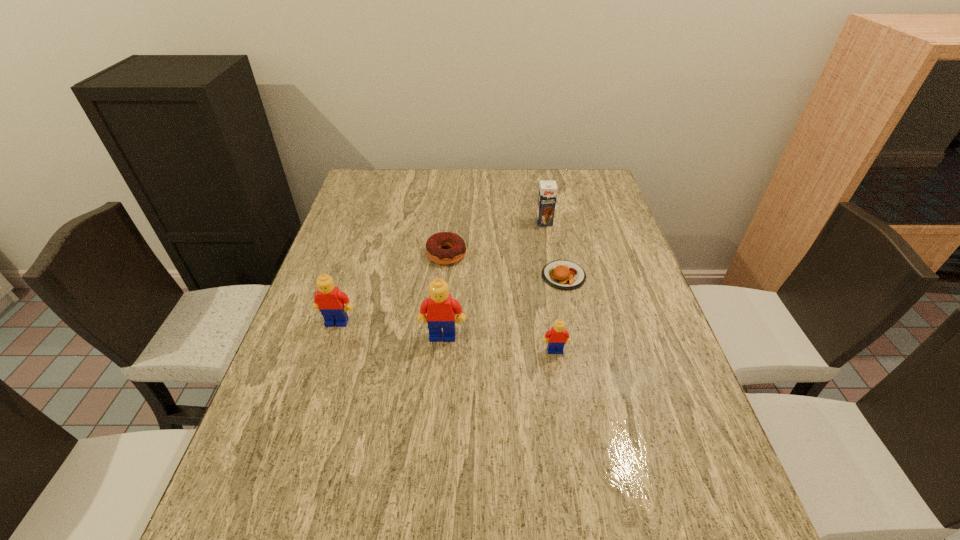
I want to click on the leftmost Lego, so click(329, 300).

The image size is (960, 540). Identify the location of the second shortest Lego. (329, 300).

Where is `the second nearest Lego`? Image resolution: width=960 pixels, height=540 pixels. the second nearest Lego is located at coordinates (440, 308).

Where is `the second Lego from right to left`? The height and width of the screenshot is (540, 960). the second Lego from right to left is located at coordinates (440, 308).

The width and height of the screenshot is (960, 540). Find the location of `the nearest Lego`. the nearest Lego is located at coordinates (558, 336).

This screenshot has width=960, height=540. Identify the location of the rightmost Lego. (558, 336).

Identify the location of the farthest object. Image resolution: width=960 pixels, height=540 pixels. (547, 195).

At what (x,y) coordinates should I click in order to perform the action: click on doughnut. Please return your answer as a coordinate pair (x, y). Looking at the image, I should click on (457, 251).

Where is `patty (food)`? patty (food) is located at coordinates (562, 274).

Identify the location of free location located 0.080m on the face of the leftmost Lego. Image resolution: width=960 pixels, height=540 pixels. (326, 354).